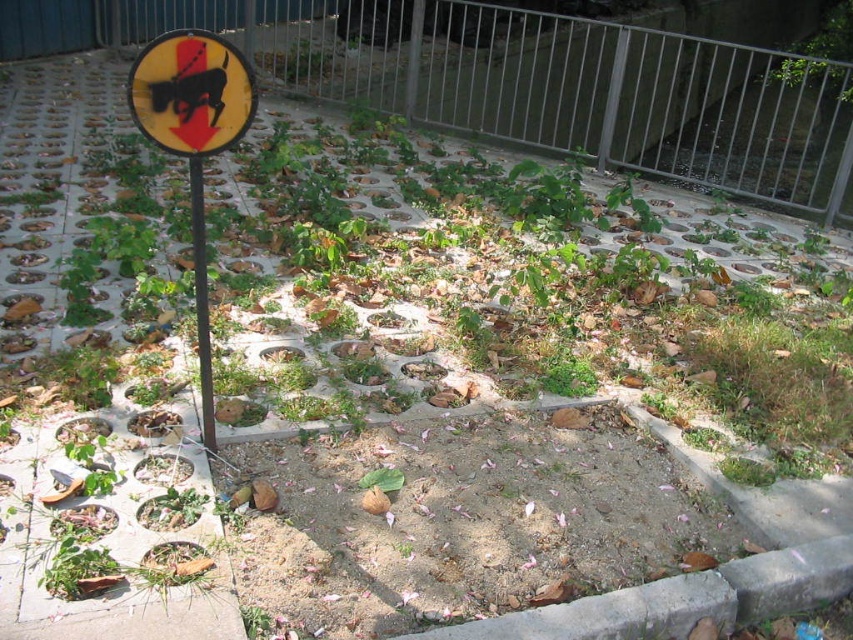
Which is more to the right, yellow matte sign at upper left or yellow reflective sign at upper left?

yellow reflective sign at upper left

Which of these two, yellow matte sign at upper left or yellow reflective sign at upper left, stands shorter?

yellow reflective sign at upper left is shorter.

This screenshot has width=853, height=640. I want to click on yellow matte sign at upper left, so click(x=193, y=140).

Between point (587, 35) and point (200, 61), which one is positioned behind?

The point (587, 35) is more distant.

Does metallic gray fence at upper center have a lesser width compared to yellow matte sign at upper left?

No, metallic gray fence at upper center is not thinner than yellow matte sign at upper left.

Is point (164, 1) positioned before point (173, 83)?

No, it is behind (173, 83).

Locate an element on the screen. metallic gray fence at upper center is located at coordinates (532, 77).

Who is taller, yellow matte sign at upper left or black metal pole at center-left?

yellow matte sign at upper left is taller.

Does point (149, 140) come farther from viewer compared to point (199, 304)?

No, it is in front of (199, 304).

This screenshot has width=853, height=640. In order to click on yellow matte sign at upper left in this screenshot , I will do `click(193, 140)`.